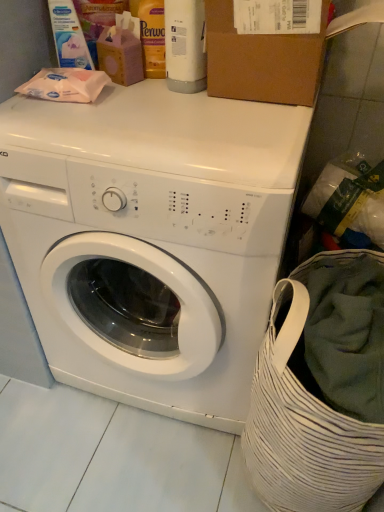
Locate an element on the screen. The height and width of the screenshot is (512, 384). vacant area in front of matte white wipes at upper left, which is counted as the second cleaning product, starting from the right is located at coordinates (70, 109).